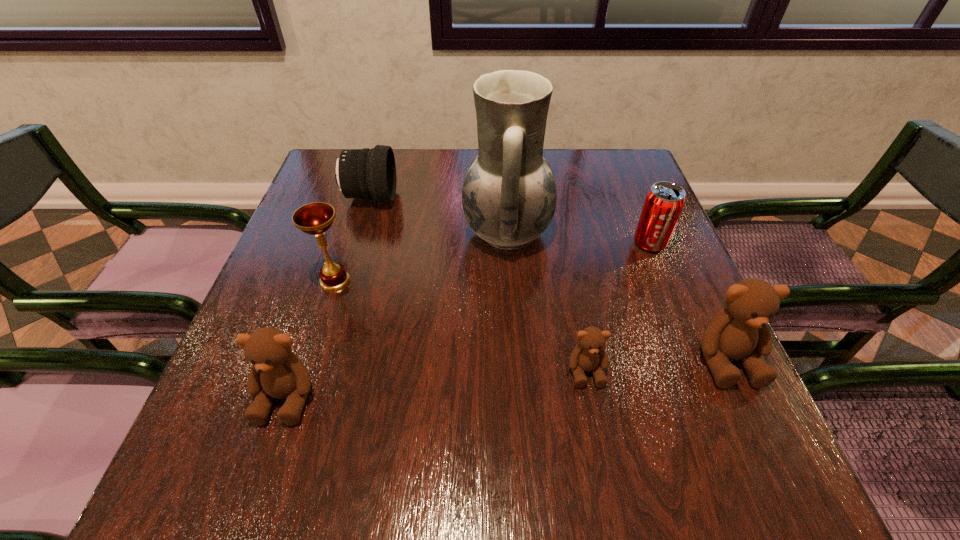
Where is `the second closest object relative to the shortest teddy bear`? This screenshot has width=960, height=540. the second closest object relative to the shortest teddy bear is located at coordinates (509, 196).

I want to click on object that is the third closest to the second teddy bear from left to right, so click(664, 202).

Identify which teddy bear is located as the second nearest to the chalice. Please provide its 2D coordinates. Your answer should be formatted as a tuple, i.e. [(x, y)], where the tuple contains the x and y coordinates of a point satisfying the conditions above.

[(589, 355)]

The image size is (960, 540). Find the location of `the closest teddy bear to the shortest object`. the closest teddy bear to the shortest object is located at coordinates (740, 332).